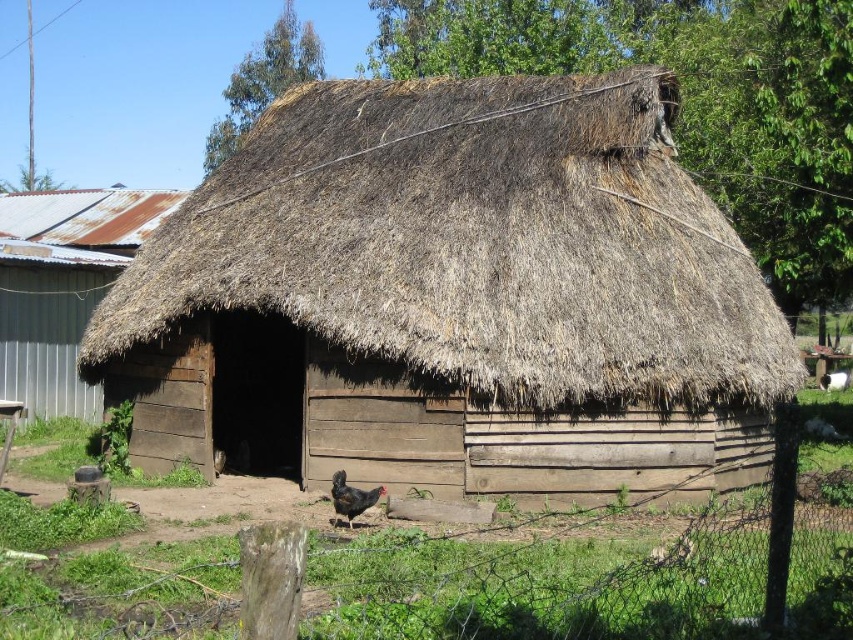
Question: Is brown wooden hut at center bigger than green grass at center?

Choices:
 (A) yes
 (B) no

Answer: (A)

Question: Which of the following is the closest to the observer?

Choices:
 (A) (332, 492)
 (B) (576, 449)

Answer: (A)

Question: Which point is closer to the camera?

Choices:
 (A) brown wooden hut at center
 (B) black feathered chicken at center
 (C) green grass at center

Answer: (C)

Question: Can you confirm if green grass at center is wider than black feathered chicken at center?

Choices:
 (A) yes
 (B) no

Answer: (A)

Question: Which point appears closest to the camera in this image?

Choices:
 (A) (798, 525)
 (B) (347, 518)
 (C) (289, 214)

Answer: (A)

Question: Does brown wooden hut at center lie behind green grass at center?

Choices:
 (A) no
 (B) yes

Answer: (B)